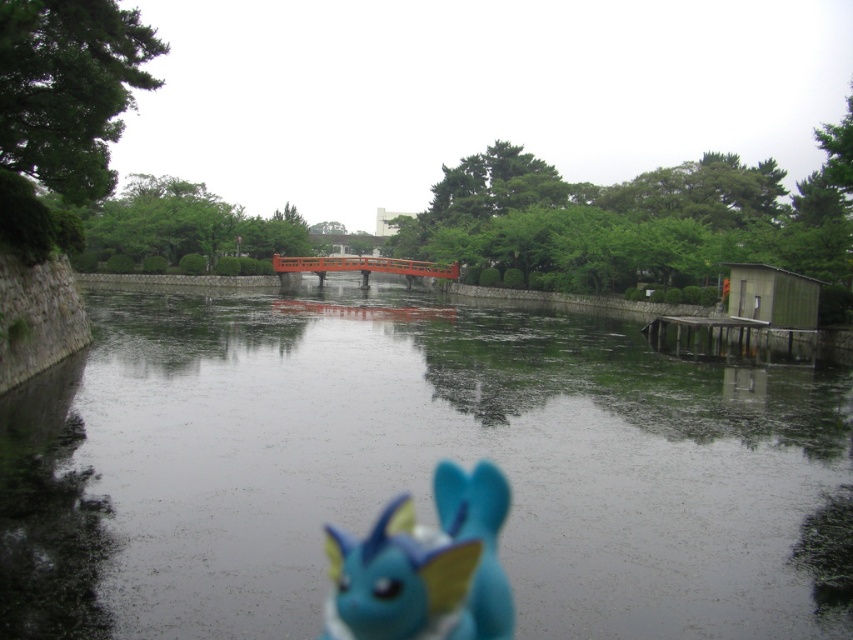
Question: In this image, where is glossy concrete river at center located relative to blue matte toy at center?

Choices:
 (A) right
 (B) left

Answer: (A)

Question: Can you confirm if glossy concrete river at center is positioned to the left of blue matte toy at center?

Choices:
 (A) no
 (B) yes

Answer: (A)

Question: Which point appears farthest from the camera in this image?

Choices:
 (A) (91, 433)
 (B) (463, 595)

Answer: (A)

Question: Can you confirm if glossy concrete river at center is wider than blue matte toy at center?

Choices:
 (A) yes
 (B) no

Answer: (A)

Question: Which point is farther to the camera?

Choices:
 (A) blue matte toy at center
 (B) glossy concrete river at center

Answer: (B)